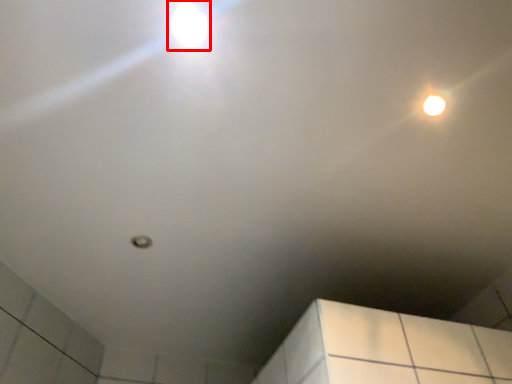
Question: From the image's perspective, where is droplight (annotated by the red box) located relative to droplight?

Choices:
 (A) above
 (B) below

Answer: (A)